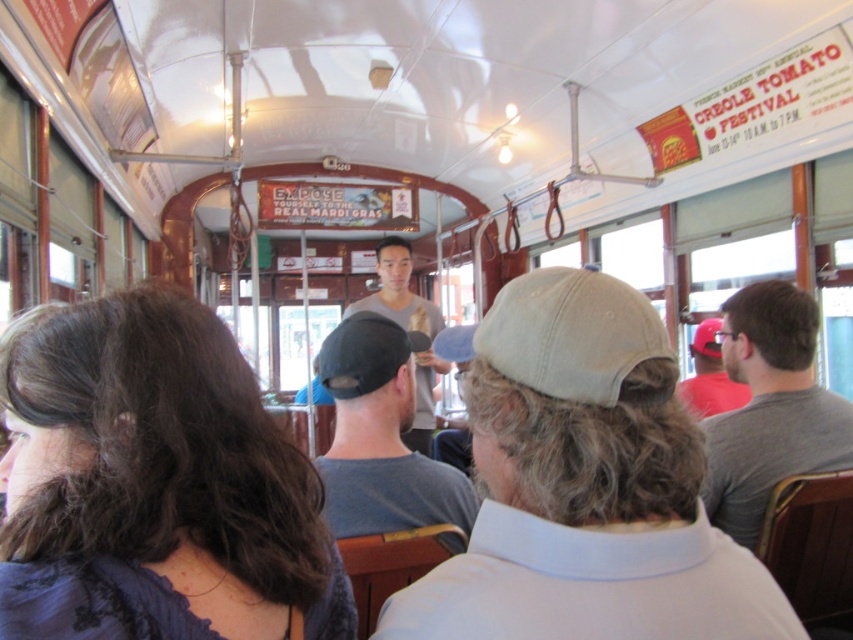
Does dark brown hair at center appear under gray matte shirt at right?

Actually, dark brown hair at center is above gray matte shirt at right.

Does dark brown hair at center appear over gray matte shirt at right?

Correct, dark brown hair at center is located above gray matte shirt at right.

Identify the location of dark brown hair at center. (160, 484).

Which is below, dark gray cotton cap at center or beige fabric baseball cap at center?

dark gray cotton cap at center

Who is more forward, (x=399, y=378) or (x=602, y=380)?

Point (x=602, y=380) is in front.

Image resolution: width=853 pixels, height=640 pixels. What are the coordinates of `dark gray cotton cap at center` in the screenshot? It's located at (381, 436).

Which is behind, point (521, 561) or point (367, 376)?

Positioned behind is point (367, 376).

Which of these two, light beige cap at center or black fabric baseball cap at center, stands taller?

Standing taller between the two is light beige cap at center.

Which is behind, point (560, 314) or point (345, 355)?

The point (345, 355) is more distant.

Find the location of a particular element. This screenshot has width=853, height=640. light beige cap at center is located at coordinates (585, 486).